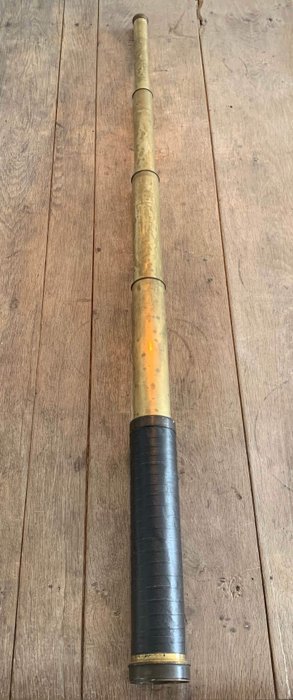
Where is `board`? Image resolution: width=293 pixels, height=700 pixels. board is located at coordinates (25, 260), (55, 602), (99, 593), (219, 575), (274, 528).